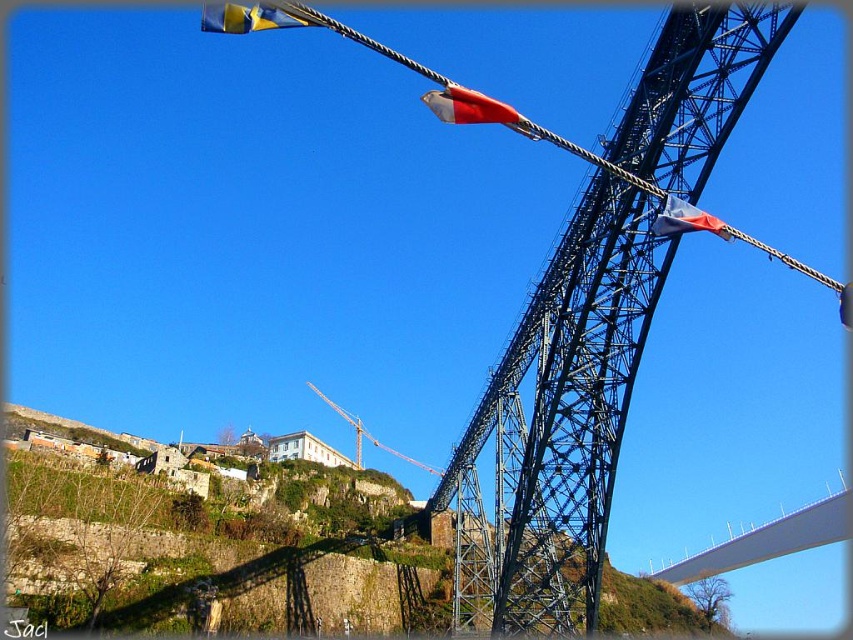
You are a photographer planning to capture the entire white smooth bridge at center and the red fabric flag at upper center in one frame. Given that the camera can only focus on objects within a 100cm width, will both objects fit in the frame?

The white smooth bridge at center is bigger than the red fabric flag at upper center, but without specific width measurements for either object, it is impossible to determine if both will fit within the 100cm width constraint.

You are a photographer planning to capture the bridge with both the blue fabric flag at upper right and the yellow metallic crane at center in the same frame. Based on their sizes in the image, which object would appear smaller?

The blue fabric flag at upper right appears smaller than the yellow metallic crane at center because its width is less than the crane.